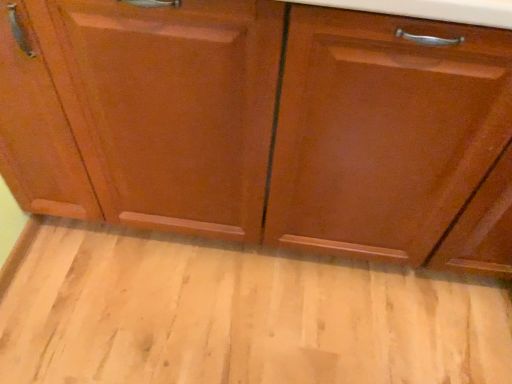
Identify the location of free spot above matte wood floor at lower center (from a real-world perspective). (244, 305).